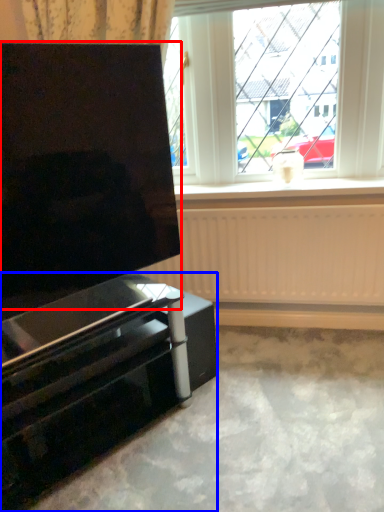
Question: Which object is further to the camera taking this photo, screen (highlighted by a red box) or furniture (highlighted by a blue box)?

Choices:
 (A) screen
 (B) furniture

Answer: (B)